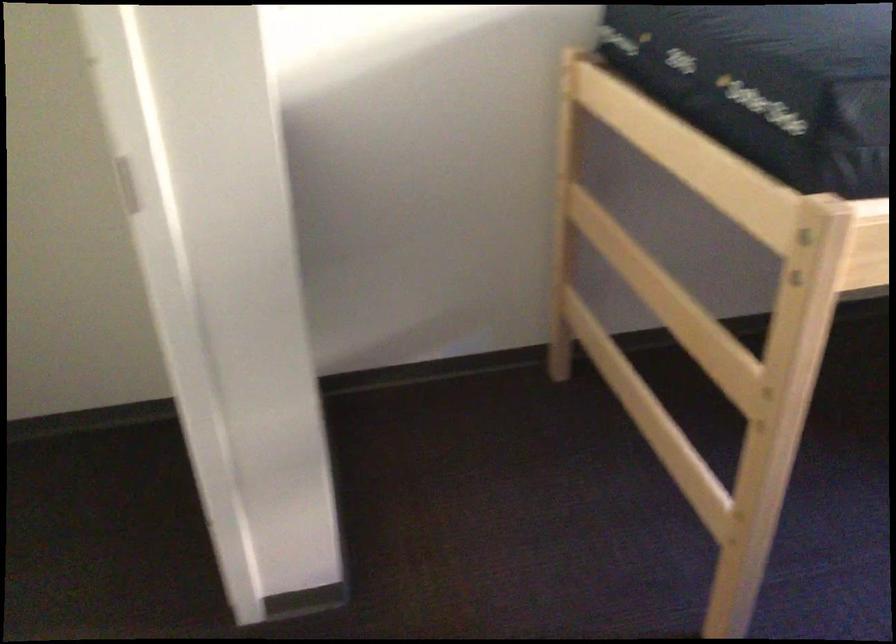
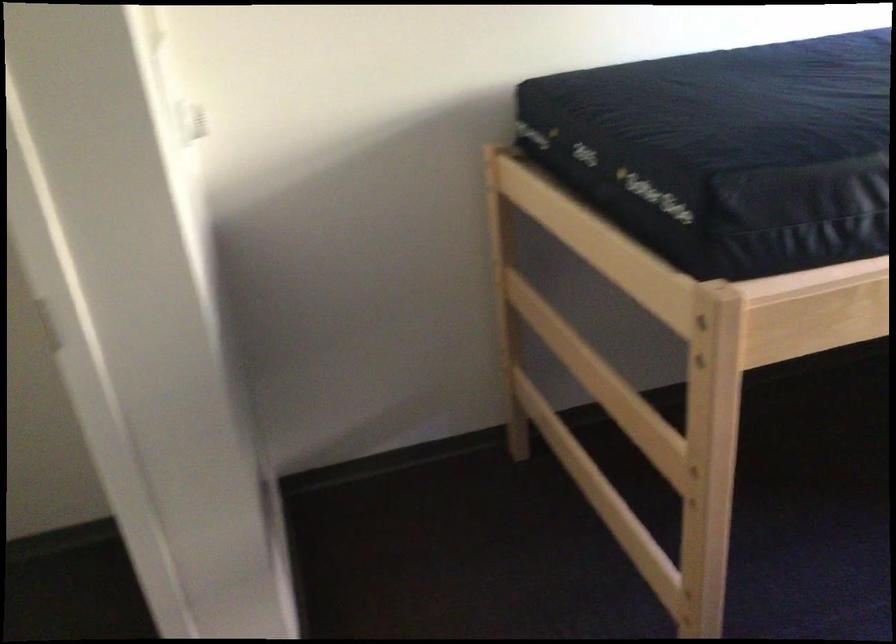
Where in the second image is the point corresponding to point (709, 504) from the first image?

(661, 582)